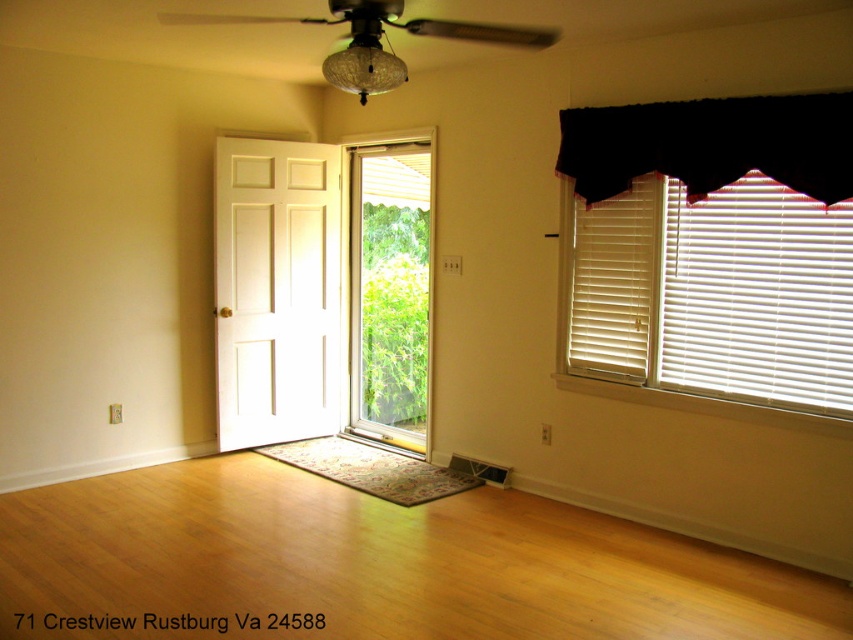
You are a delivery person holding a package that measures 3 feet in length. You need to enter the room through the white glossy screen door at center and deliver it to the white wood blinds at right. Can you carry the package horizontally without tilting it? Please explain your reasoning.

The distance between the white wood blinds at right and the white glossy screen door at center is 7.45 feet. Since the package is only 3 feet long, there is enough space to carry it horizontally without tilting it.